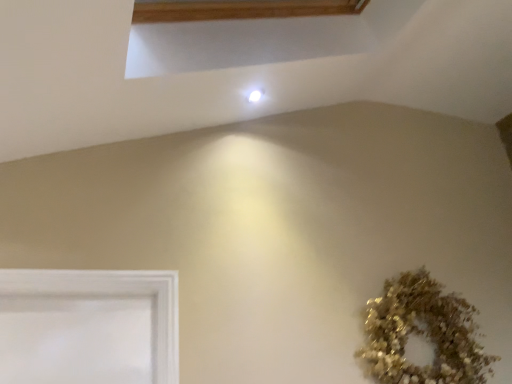
What do you see at coordinates (422, 334) in the screenshot? I see `gold glittery wreath at lower right` at bounding box center [422, 334].

Measure the distance between gold glittery wreath at lower right and camera.

6.05 feet.

Image resolution: width=512 pixels, height=384 pixels. Identify the location of gold glittery wreath at lower right. (422, 334).

You are a GUI agent. You are given a task and a screenshot of the screen. Output one action in this format:
    pyautogui.click(x=<x>, y=<y>)
    Task: Click on the gold glittery wreath at lower right
    The image size is (512, 384).
    Given the screenshot: What is the action you would take?
    pyautogui.click(x=422, y=334)